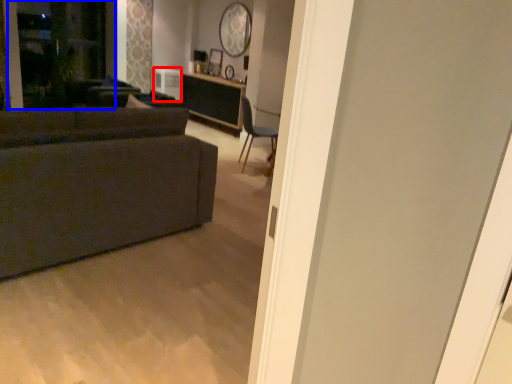
Question: Which of the following is the closest to the observer, appliance (highlighted by a red box) or screen door (highlighted by a blue box)?

Choices:
 (A) appliance
 (B) screen door

Answer: (B)